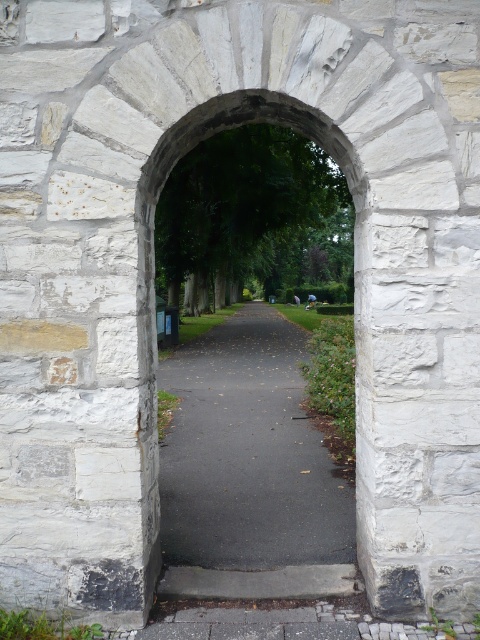
Is stone archway at center positioned at the back of black asphalt path at center?

That is False.

Does point (238, 216) lie in front of point (245, 493)?

No.

Find the location of a particular element. stone archway at center is located at coordinates (248, 458).

The image size is (480, 640). In order to click on stone archway at center in this screenshot , I will do `click(248, 458)`.